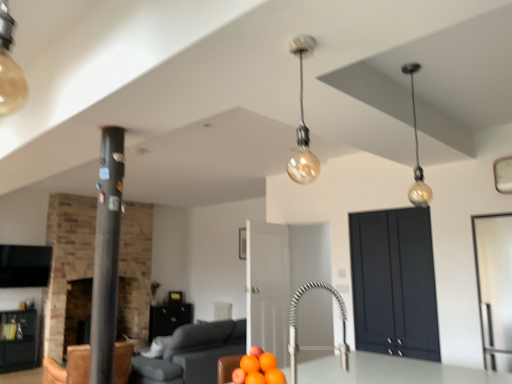
Question: Does brick fireplace at left, which appears as the 2th fireplace when viewed from the left, have a lesser height compared to leather armchair at lower left?

Choices:
 (A) yes
 (B) no

Answer: (B)

Question: From a real-world perspective, does brick fireplace at left, the 1th fireplace positioned from the right, stand above leather armchair at lower left?

Choices:
 (A) yes
 (B) no

Answer: (A)

Question: Is brick fireplace at left, the 1th fireplace positioned from the right, far from leather armchair at lower left?

Choices:
 (A) no
 (B) yes

Answer: (B)

Question: Is brick fireplace at left, the 1th fireplace positioned from the right, not inside leather armchair at lower left?

Choices:
 (A) yes
 (B) no

Answer: (A)

Question: Is brick fireplace at left, the 1th fireplace positioned from the right, behind leather armchair at lower left?

Choices:
 (A) no
 (B) yes

Answer: (B)

Question: Is point (215, 345) positioned closer to the camera than point (305, 36)?

Choices:
 (A) farther
 (B) closer

Answer: (A)

Question: Do you think matte gray sofa at lower center is within translucent glass bulb at center, which appears as the first light fixture when viewed from the front, or outside of it?

Choices:
 (A) inside
 (B) outside

Answer: (B)

Question: From a real-world perspective, is matte gray sofa at lower center above or below translucent glass bulb at center, arranged as the 1th light fixture when viewed from the left?

Choices:
 (A) below
 (B) above

Answer: (A)

Question: Would you say matte gray sofa at lower center is to the left or to the right of translucent glass bulb at center, which appears as the first light fixture when viewed from the front, in the picture?

Choices:
 (A) right
 (B) left

Answer: (B)

Question: From the image's perspective, relative to dark matte cabinet at center right, which appears as the 3th cabinetry when ordered from the bottom, is matte black cabinet at left, the second cabinetry from the back, above or below?

Choices:
 (A) above
 (B) below

Answer: (B)

Question: Considering the positions of matte black cabinet at left, which is the second cabinetry from front to back, and dark matte cabinet at center right, which appears as the 3th cabinetry when ordered from the bottom, in the image, is matte black cabinet at left, which is the second cabinetry from front to back, taller or shorter than dark matte cabinet at center right, which appears as the 3th cabinetry when ordered from the bottom,?

Choices:
 (A) tall
 (B) short

Answer: (B)

Question: From a real-world perspective, is matte black cabinet at left, the second cabinetry positioned from the top, physically located above or below dark matte cabinet at center right, which is the 1th cabinetry from front to back?

Choices:
 (A) above
 (B) below

Answer: (B)

Question: Is matte black cabinet at left, which is the second cabinetry from front to back, inside the boundaries of dark matte cabinet at center right, which appears as the 3th cabinetry when ordered from the bottom, or outside?

Choices:
 (A) inside
 (B) outside

Answer: (B)

Question: Is matte black cabinet at lower center, the 2th cabinetry when ordered from right to left, taller or shorter than brick fireplace at left, the second fireplace positioned from the right?

Choices:
 (A) short
 (B) tall

Answer: (A)

Question: Is matte black cabinet at lower center, the third cabinetry in the front-to-back sequence, in front of or behind brick fireplace at left, which appears as the first fireplace when viewed from the left, in the image?

Choices:
 (A) behind
 (B) front

Answer: (A)